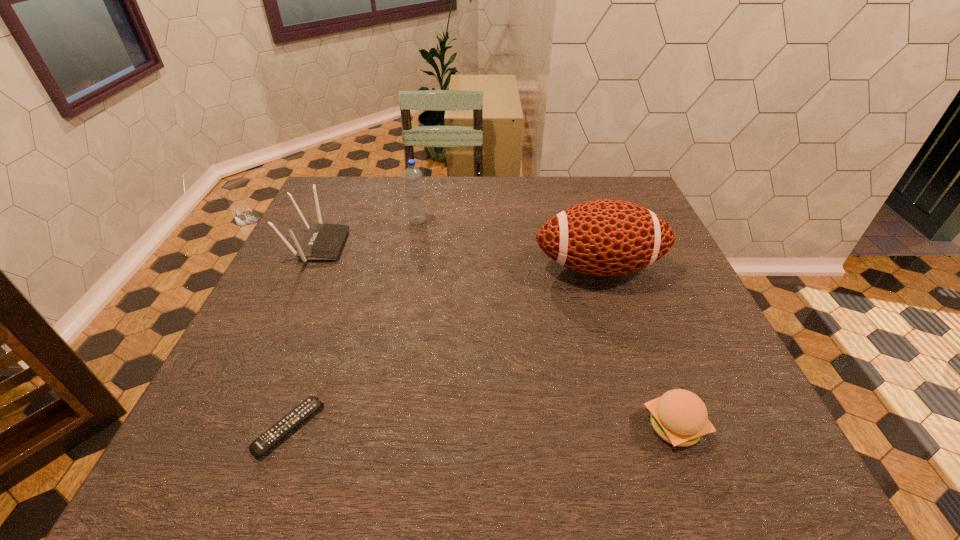
The width and height of the screenshot is (960, 540). Find the location of `vacant space at the near edge`. vacant space at the near edge is located at coordinates (548, 477).

The width and height of the screenshot is (960, 540). In order to click on vacant area at the left edge of the desktop in this screenshot , I will do `click(258, 303)`.

The height and width of the screenshot is (540, 960). Identify the location of free space at the near left corner of the desktop. (221, 436).

The width and height of the screenshot is (960, 540). Find the location of `vacant space at the far right corner`. vacant space at the far right corner is located at coordinates tap(588, 186).

Find the location of a particular element. The image size is (960, 540). vacant region at the near right corner of the desktop is located at coordinates (733, 463).

The height and width of the screenshot is (540, 960). I want to click on vacant space that's between the football and the hamburger, so click(636, 347).

Identify the location of vacant point located between the second shortest object and the shortest object. (482, 427).

I want to click on free space between the football and the third object from left to right, so click(508, 244).

The height and width of the screenshot is (540, 960). I want to click on free space between the football and the third object from left to right, so click(x=508, y=244).

Locate an element on the screen. The width and height of the screenshot is (960, 540). blank region between the shortest object and the third object from right to left is located at coordinates (353, 324).